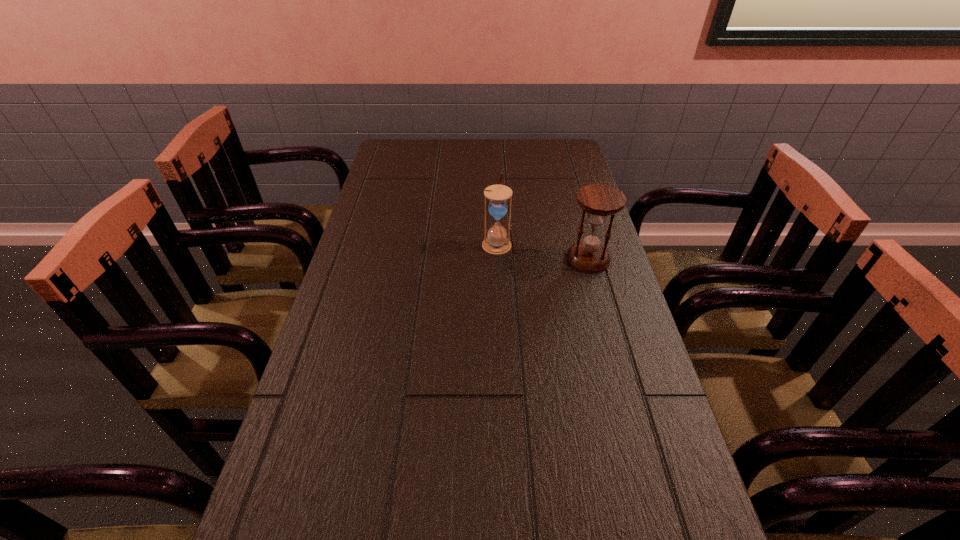
Identify the location of free point between the right hourglass and the left hourglass. (542, 251).

The height and width of the screenshot is (540, 960). What are the coordinates of `vacant space that satisfies the following two spatial constraints: 1. on the front side of the left hourglass; 2. on the left side of the right hourglass` in the screenshot? It's located at (497, 259).

Locate an element on the screen. free location that satisfies the following two spatial constraints: 1. on the front side of the left hourglass; 2. on the left side of the right object is located at coordinates (497, 259).